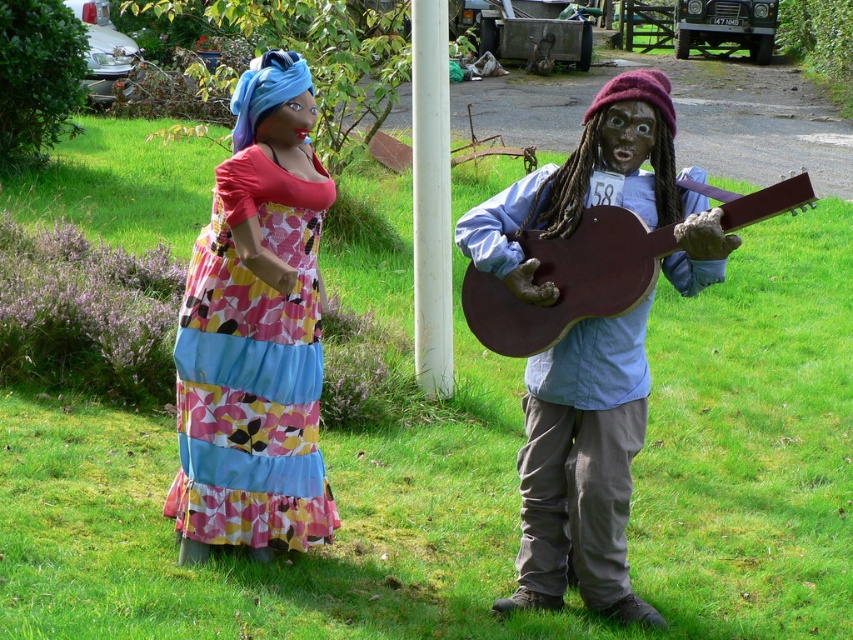
Does matte fabric dress at left have a greater height compared to brown matte guitar at right?

Yes.

Is matte fabric dress at left above brown matte guitar at right?

No, matte fabric dress at left is not above brown matte guitar at right.

Is point (561, 602) farther from viewer compared to point (572, 269)?

Yes, it is behind point (572, 269).

Locate an element on the screen. matte fabric dress at left is located at coordinates (582, 468).

Does matte brown guitar at center appear over brown matte guitar at right?

Actually, matte brown guitar at center is below brown matte guitar at right.

What do you see at coordinates (582, 468) in the screenshot?
I see `matte brown guitar at center` at bounding box center [582, 468].

You are a GUI agent. You are given a task and a screenshot of the screen. Output one action in this format:
    pyautogui.click(x=<x>, y=<y>)
    Task: Click on the matte brown guitar at center
    The height and width of the screenshot is (640, 853).
    Given the screenshot: What is the action you would take?
    pyautogui.click(x=582, y=468)

You are a GUI agent. You are given a task and a screenshot of the screen. Output one action in this format:
    pyautogui.click(x=<x>, y=<y>)
    Task: Click on the matte brown guitar at center
    
    Given the screenshot: What is the action you would take?
    pyautogui.click(x=582, y=468)

Who is taller, matte brown guitar at center or floral fabric dress at left?

matte brown guitar at center is taller.

Find the location of a particular element. The image size is (853, 640). matte brown guitar at center is located at coordinates (582, 468).

This screenshot has width=853, height=640. I want to click on matte brown guitar at center, so click(582, 468).